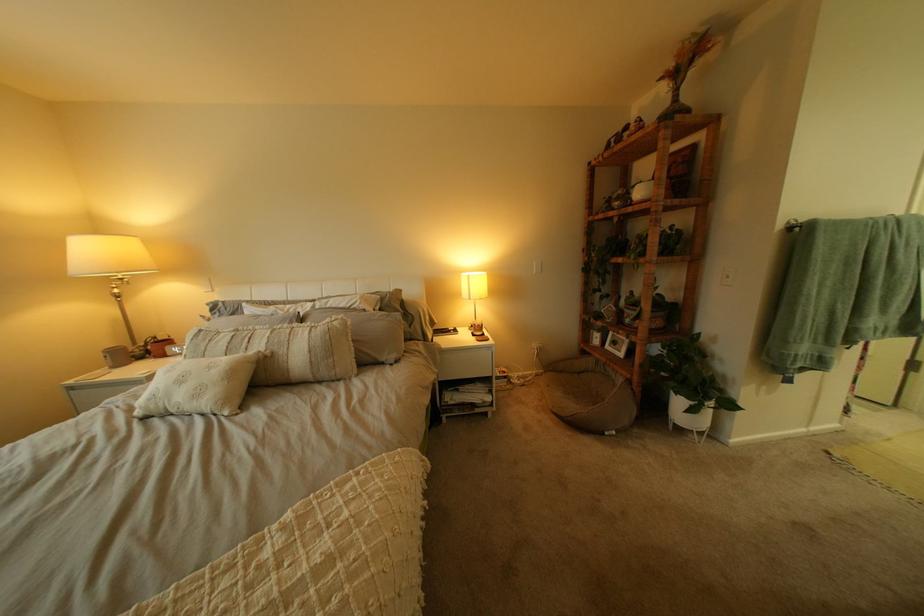
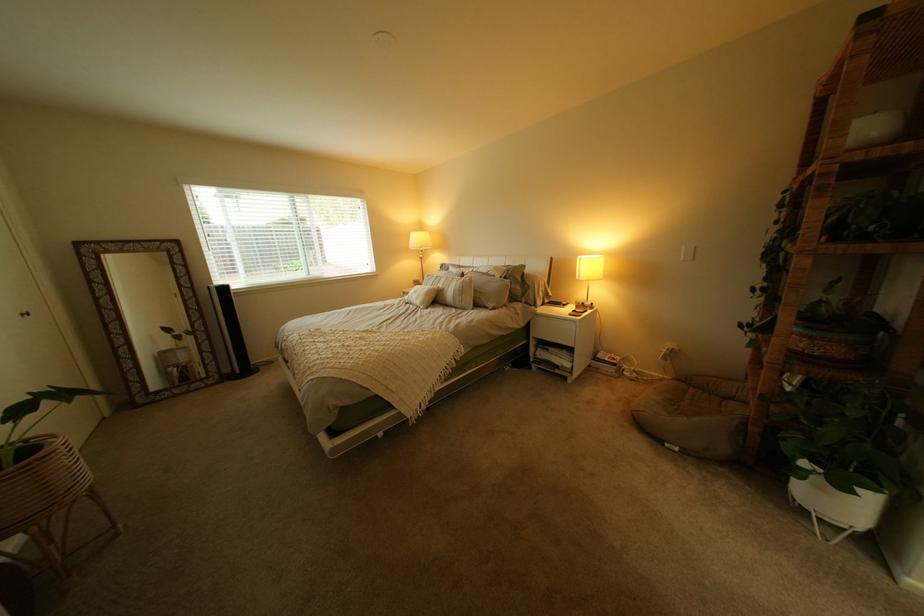
The point at (196, 382) is marked in the first image. Where is the corresponding point in the second image?

(431, 293)